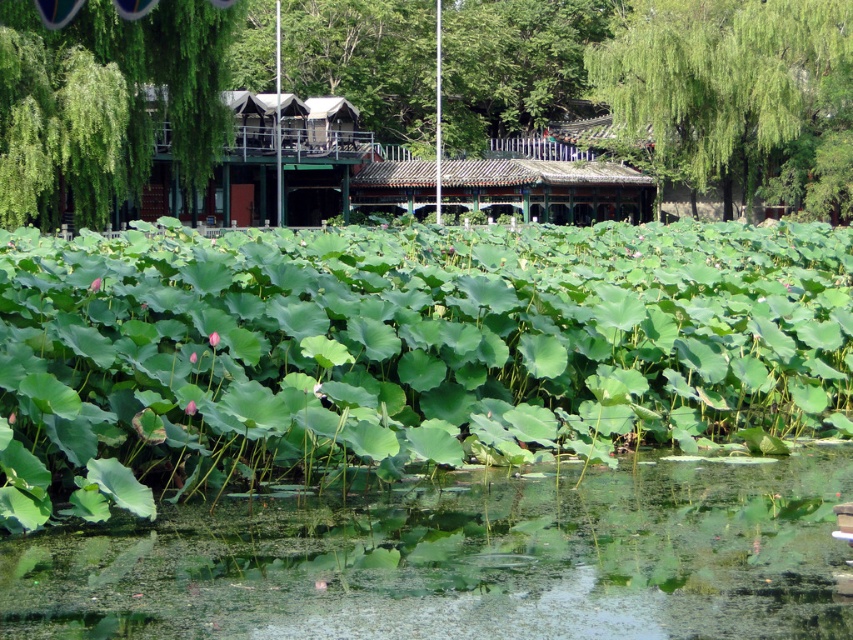
You are a visitor in the park and want to take a photo of the green wooden structure at center and the brown tiled hut at center. Which one is directly above the other?

The green wooden structure at center is positioned over the brown tiled hut at center.